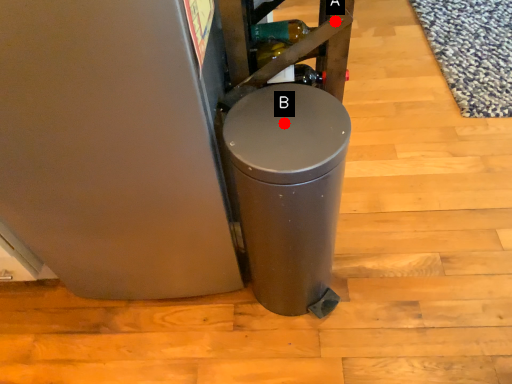
Question: Two points are circled on the image, labeled by A and B beside each circle. Which point is closer to the camera?

Choices:
 (A) A is closer
 (B) B is closer

Answer: (B)